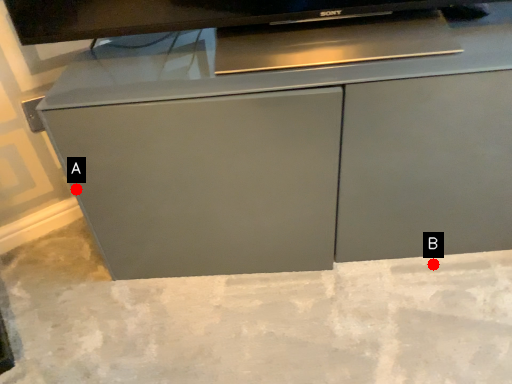
Question: Two points are circled on the image, labeled by A and B beside each circle. Among these points, which one is farthest from the camera?

Choices:
 (A) A is further
 (B) B is further

Answer: (B)